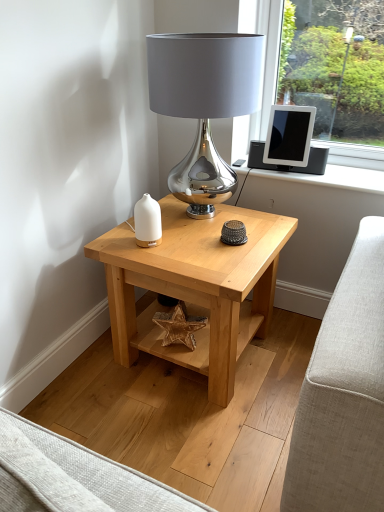
Where is `free spot in front of white matte vase at center`? free spot in front of white matte vase at center is located at coordinates (153, 260).